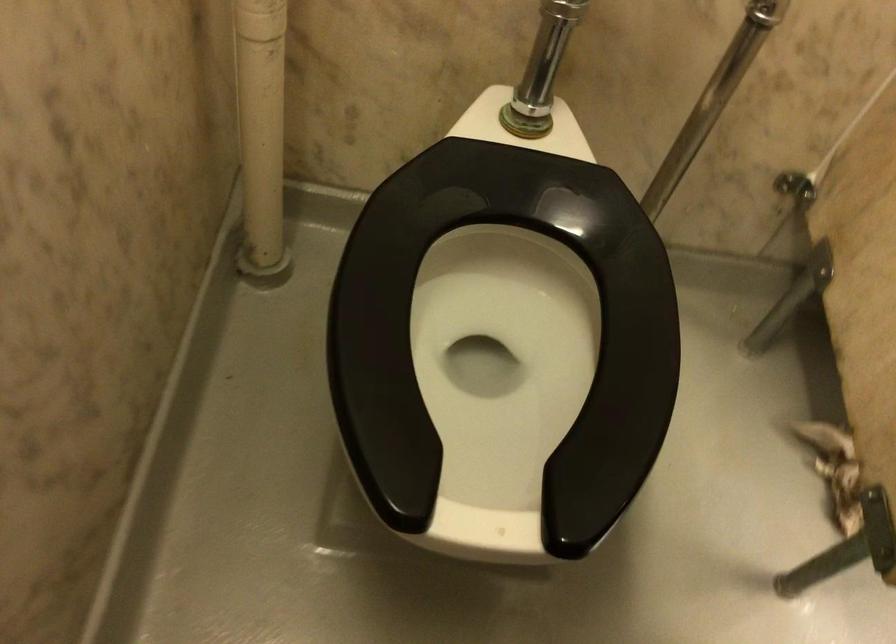
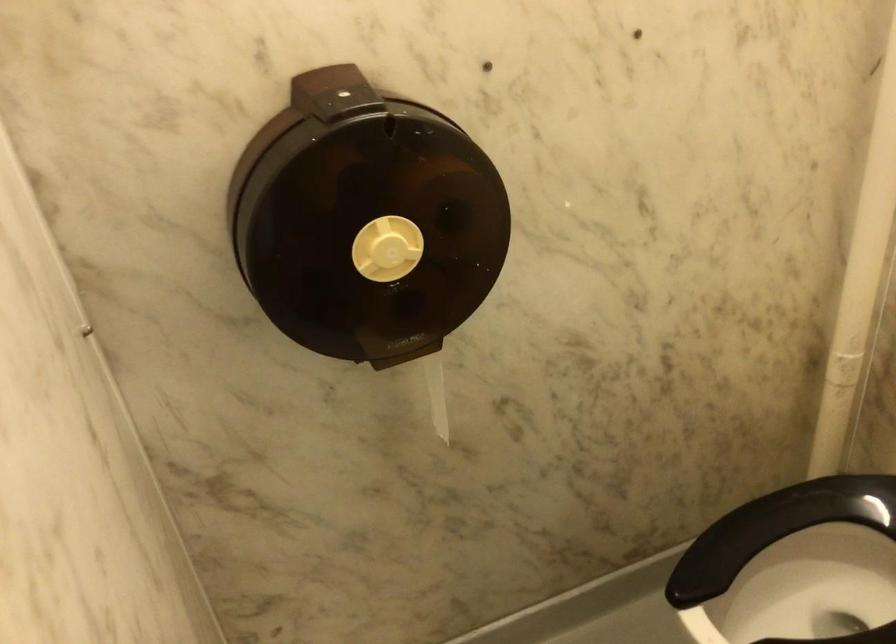
Question: The images are taken continuously from a first-person perspective. In which direction is your viewpoint rotating?

Choices:
 (A) Left
 (B) Right
 (C) Up
 (D) Down

Answer: (A)